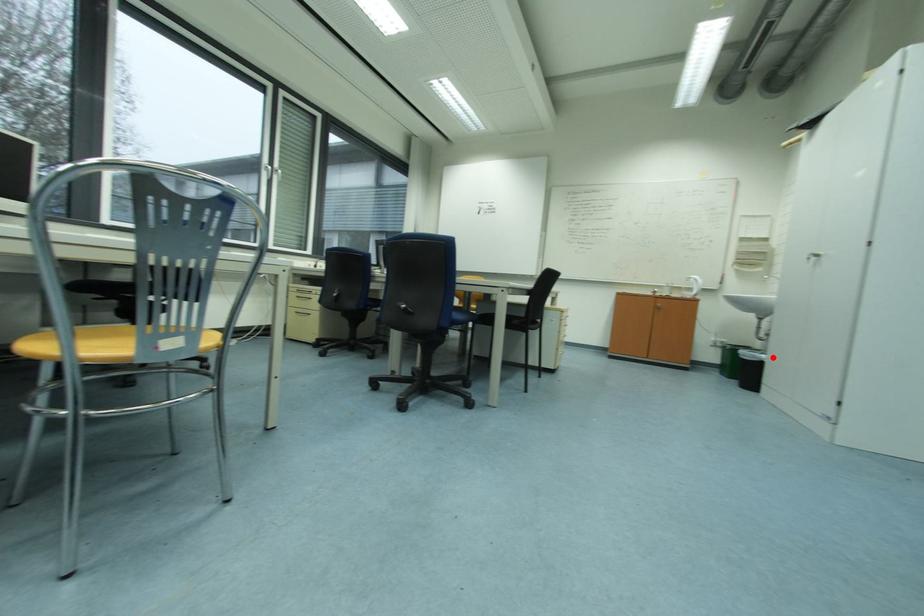
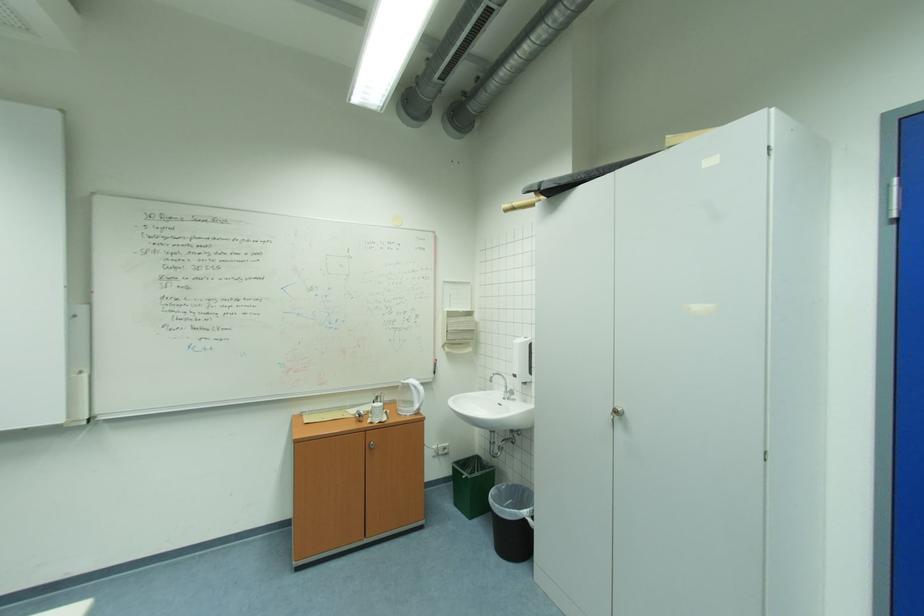
In the second image, find the point that corresponds to the highlighted location in the first image.

(532, 513)